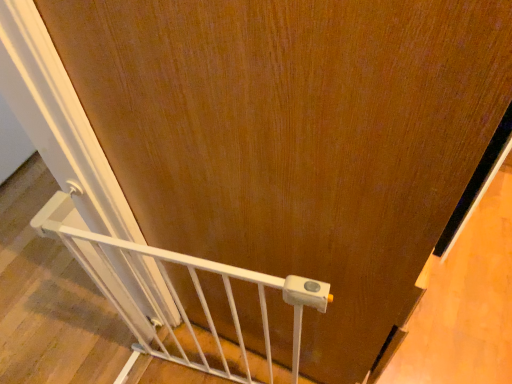
What is the approximate height of white matte gate at lower left?

white matte gate at lower left is 71.27 centimeters in height.

Measure the distance between white matte gate at lower left and camera.

A distance of 25.48 inches exists between white matte gate at lower left and camera.

Describe the element at coordinates (181, 299) in the screenshot. I see `white matte gate at lower left` at that location.

Where is `white matte gate at lower left`? The width and height of the screenshot is (512, 384). white matte gate at lower left is located at coordinates (181, 299).

At what (x,y) coordinates should I click in order to perform the action: click on white matte gate at lower left. Please return your answer as a coordinate pair (x, y). Looking at the image, I should click on (181, 299).